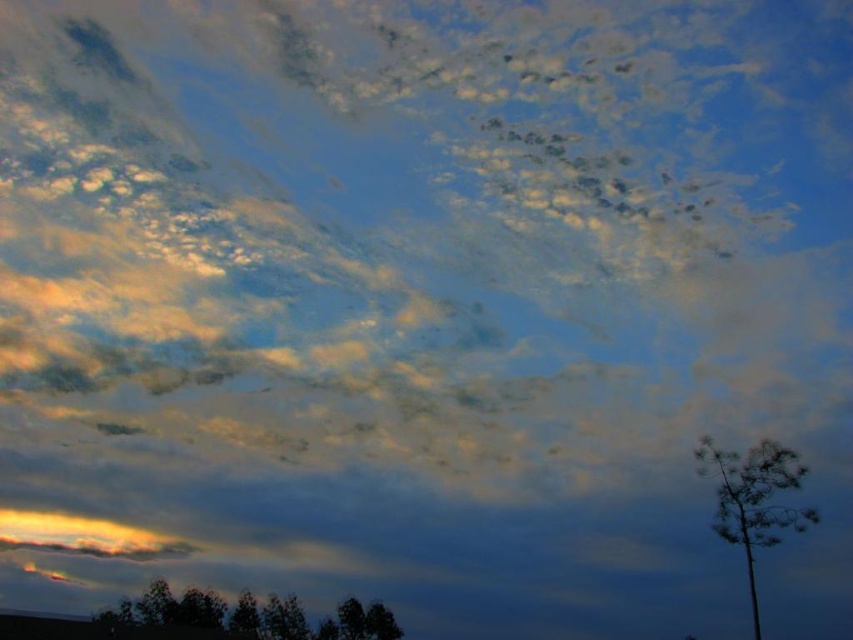
Consider the image. You are standing at the camera position looking at the dark green leafy tree at lower center. If you walk straight towards it for 100 feet, will you reach the tree?

The distance between you and the dark green leafy tree at lower center is 138.08 feet. After walking 100 feet, you will still be 38.08 feet away from the tree.

You are an artist trying to paint this scene. You want to ensure the dark green leafy tree at lower center and the silhouette bark tree at right are proportionally accurate. Which tree should you draw bigger?

The dark green leafy tree at lower center should be drawn bigger since it is larger in size than the silhouette bark tree at right according to the description.

You are an artist trying to paint the scene. You want to ensure the trees are proportionate. Which tree, the dark green leafy tree at lower center or the silhouette bark tree at right, should you paint wider?

The dark green leafy tree at lower center should be painted wider since its width is larger than the silhouette bark tree at right.